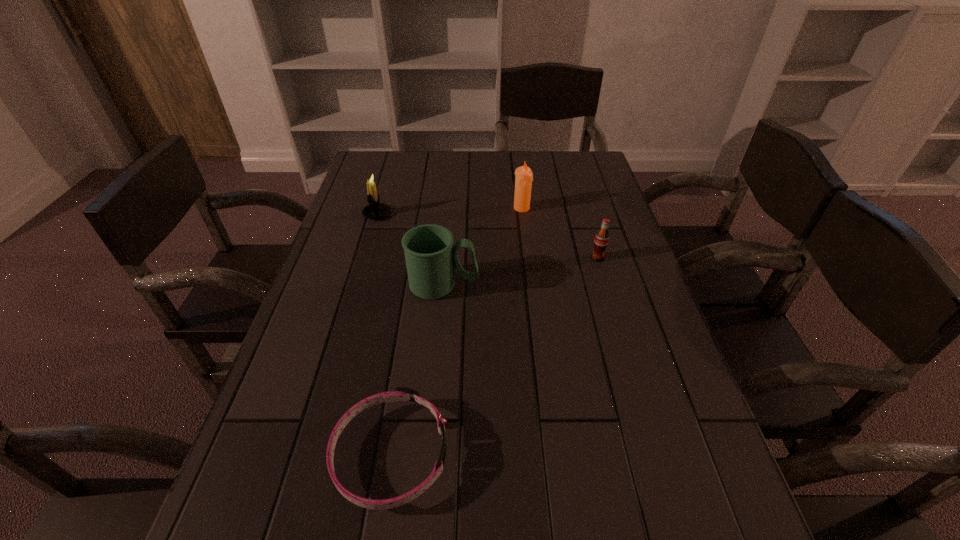
Locate an element on the screen. Image resolution: width=960 pixels, height=540 pixels. candle is located at coordinates (523, 181).

Locate an element on the screen. The width and height of the screenshot is (960, 540). mug is located at coordinates (431, 257).

The width and height of the screenshot is (960, 540). In order to click on candle holder in this screenshot , I will do pyautogui.click(x=375, y=210).

Identify the location of the rightmost object. (x=601, y=240).

Locate an element on the screen. the third farthest object is located at coordinates (601, 240).

Where is `the nearest object`? Image resolution: width=960 pixels, height=540 pixels. the nearest object is located at coordinates (400, 394).

Locate an element on the screen. The image size is (960, 540). the shortest object is located at coordinates (400, 394).

In order to click on free region located on the front of the fourth object from left to right in this screenshot , I will do `click(524, 227)`.

Locate an element on the screen. The width and height of the screenshot is (960, 540). free space located 0.400m on the side of the mug with the handle is located at coordinates (635, 285).

Locate an element on the screen. The image size is (960, 540). vacant space situated 0.320m on the right of the leftmost object is located at coordinates (494, 214).